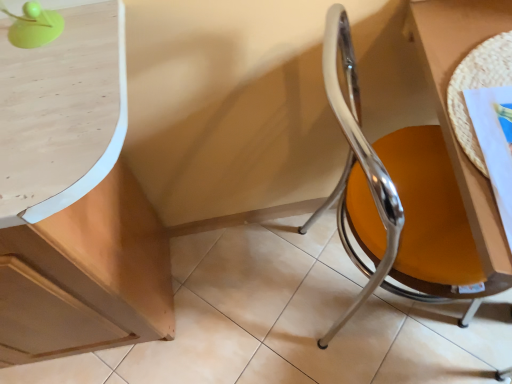
Where is `free point below chrome/yellow seat at right (from a real-world perspective)`? free point below chrome/yellow seat at right (from a real-world perspective) is located at coordinates (340, 286).